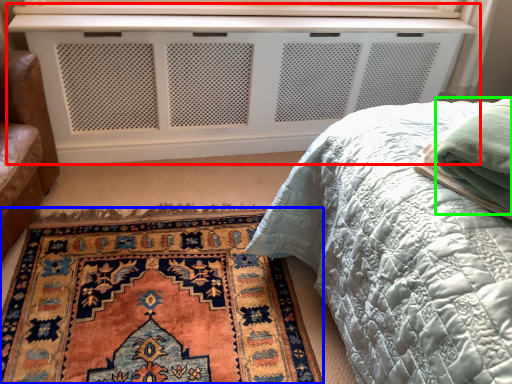
Question: Considering the real-world distances, which object is farthest from vanity (highlighted by a red box)? mat (highlighted by a blue box) or material (highlighted by a green box)?

Choices:
 (A) mat
 (B) material

Answer: (B)